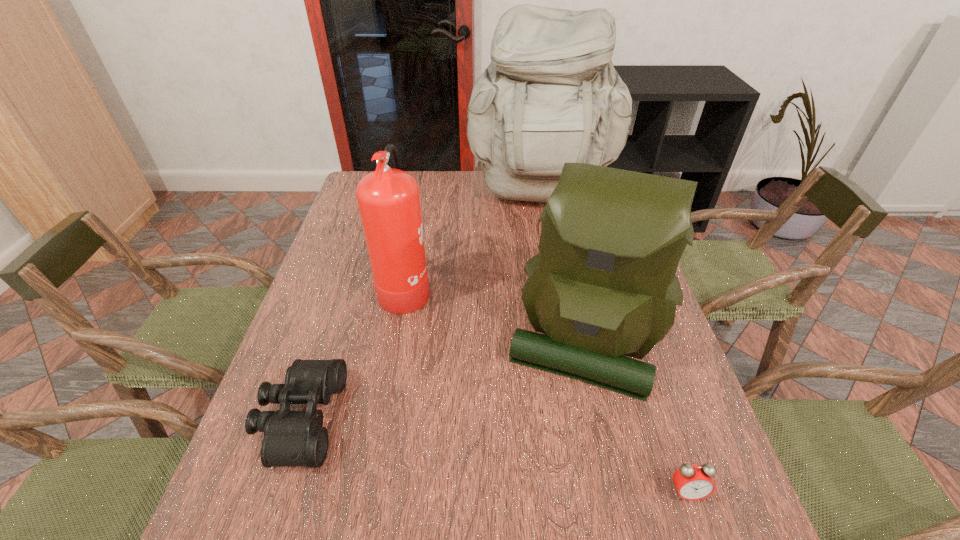
What are the coordinates of `free location that satisfies the following two spatial constraints: 1. on the front of the nearer backpack with visible pockets; 2. at the eyepieces of the leftmost object` in the screenshot? It's located at (600, 418).

In order to click on free space that satisfies the following two spatial constraints: 1. on the front-facing side of the tallest object; 2. at the eyepieces of the binoculars in this screenshot , I will do `click(581, 418)`.

At what (x,y) coordinates should I click in order to perform the action: click on vacant space that satisfies the following two spatial constraints: 1. on the front-facing side of the farther backpack; 2. towards the nozzle of the fire extinguisher. Please return your answer as a coordinate pair (x, y). This screenshot has width=960, height=540. Looking at the image, I should click on (556, 286).

Where is `vacant space that satisfies the following two spatial constraints: 1. on the front of the nearer backpack with visible pockets; 2. at the eyepieces of the leftmost object`? The width and height of the screenshot is (960, 540). vacant space that satisfies the following two spatial constraints: 1. on the front of the nearer backpack with visible pockets; 2. at the eyepieces of the leftmost object is located at coordinates (600, 418).

This screenshot has width=960, height=540. I want to click on vacant space that satisfies the following two spatial constraints: 1. on the front-facing side of the farthest object; 2. towards the nozzle of the fire extinguisher, so click(556, 286).

Where is `free space that satisfies the following two spatial constraints: 1. on the front-facing side of the tallest object; 2. at the eyepieces of the leftmost object`? free space that satisfies the following two spatial constraints: 1. on the front-facing side of the tallest object; 2. at the eyepieces of the leftmost object is located at coordinates (581, 418).

I want to click on blank space that satisfies the following two spatial constraints: 1. on the front of the nearer backpack with visible pockets; 2. at the eyepieces of the leftmost object, so click(600, 418).